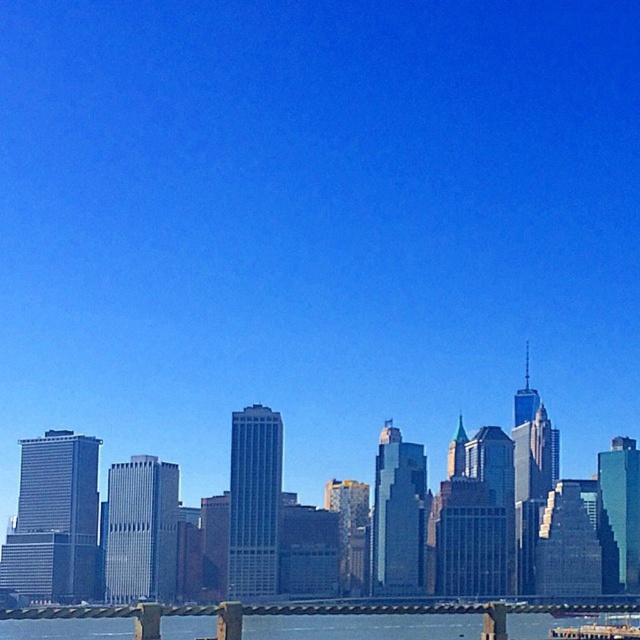
You are standing on a pier and see the clear water at lower center and the metallic ferry at lower center. Which object is closer to you?

The clear water at lower center is closer to you because it is in front of the metallic ferry at lower center.

You are standing on the dock and see a point marked at coordinates [307,612]. Based on the scene description, where is this point located?

The point is on the clear water at lower center, which is part of the body of water reflecting the city skyline.

Based on the photo, you are standing on the dock and want to take a photo of the tallest building. Where should you aim your camera to avoid the reflection of the clear water at lower center?

You should aim your camera above the clear water at lower center to avoid its reflection, as the reflection is located at point coordinates (307, 612).